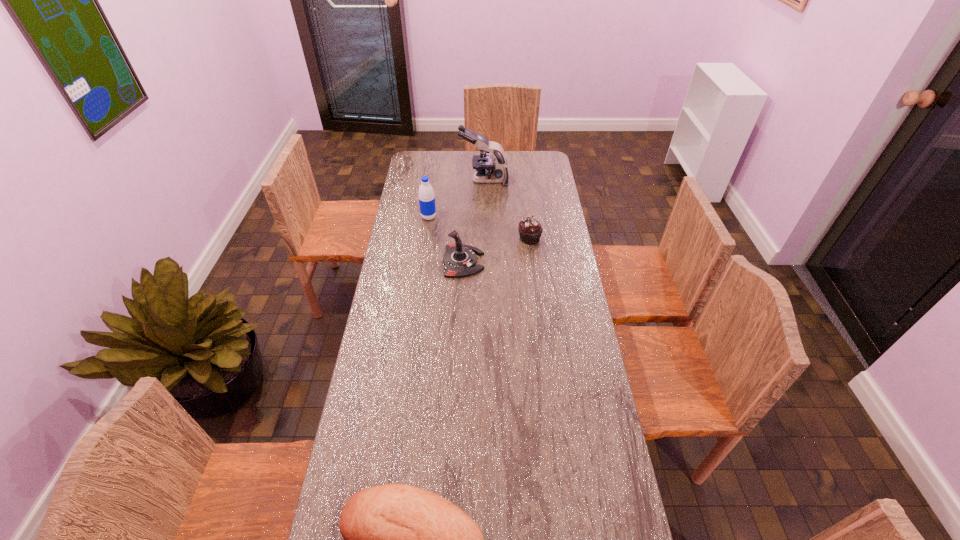
Locate an element on the screen. Image resolution: width=960 pixels, height=540 pixels. microscope is located at coordinates (488, 169).

Locate an element on the screen. the farthest object is located at coordinates (488, 169).

At what (x,y) coordinates should I click in order to perform the action: click on the second farthest object. Please return your answer as a coordinate pair (x, y). Looking at the image, I should click on (426, 194).

Where is `water bottle`? This screenshot has height=540, width=960. water bottle is located at coordinates (426, 194).

Where is `joystick`? Image resolution: width=960 pixels, height=540 pixels. joystick is located at coordinates (459, 260).

Find the location of a particular element. This screenshot has width=960, height=540. cupcake is located at coordinates (530, 230).

Identify the location of free location located through the eyepieces of the farthest object. This screenshot has height=540, width=960. (425, 180).

Locate an element on the screen. This screenshot has width=960, height=540. free space located through the eyepieces of the farthest object is located at coordinates (429, 180).

This screenshot has width=960, height=540. I want to click on vacant area situated through the eyepieces of the farthest object, so click(x=450, y=180).

Find the location of a particular element. The image size is (960, 540). free location located on the front of the fourth nearest object is located at coordinates (423, 253).